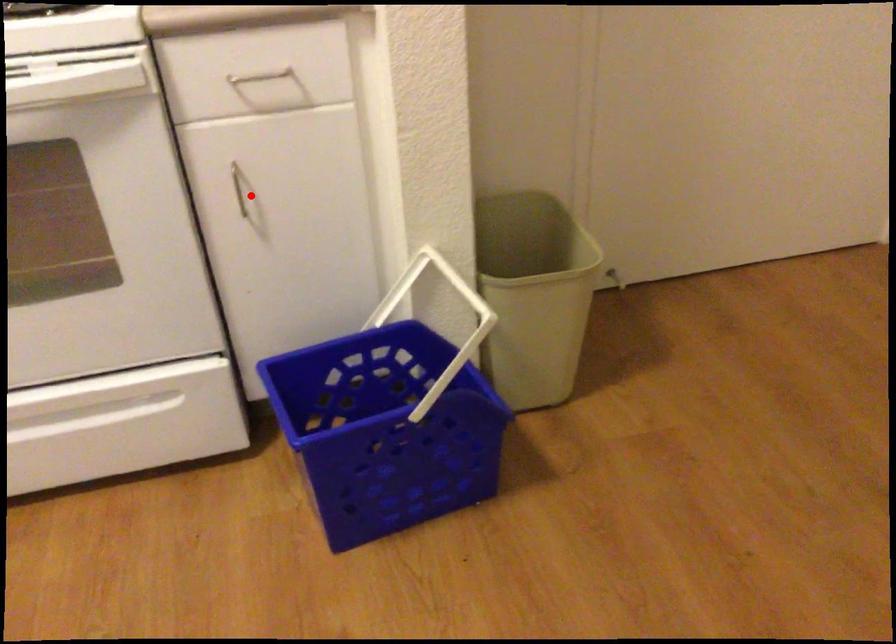
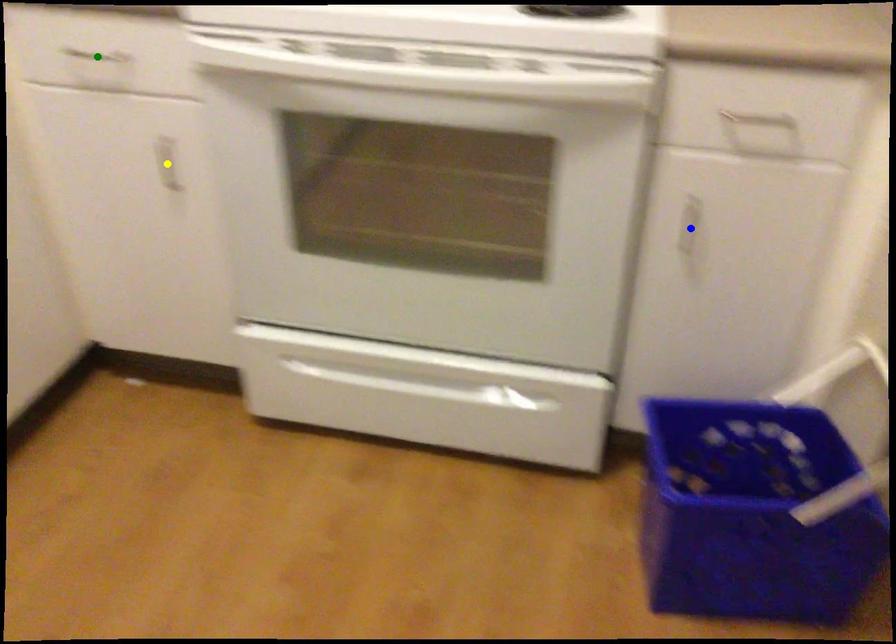
Question: I am providing you with two images of the same scene from different viewpoints. A red point is marked on the first image. You are given multiple points on the second image. Can you choose the point in image 2 that corresponds to the point in image 1?

Choices:
 (A) green point
 (B) yellow point
 (C) blue point

Answer: (C)